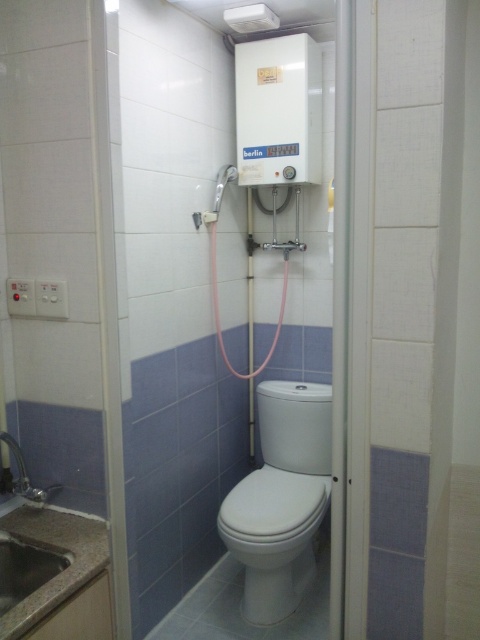
Looking at this image, does white glossy toilet at center appear on the left side of matte white shower at upper center?

In fact, white glossy toilet at center is to the right of matte white shower at upper center.

Is point (312, 556) farther from viewer compared to point (219, 179)?

Yes, point (312, 556) is behind point (219, 179).

Locate an element on the screen. white glossy toilet at center is located at coordinates (280, 499).

Looking at this image, does white glossy toilet at center appear over granite sink at lower left?

No, white glossy toilet at center is not above granite sink at lower left.

Between point (252, 576) and point (60, 556), which one is positioned in front?

Point (60, 556) is in front.

Is point (229, 540) positioned in front of point (2, 577)?

No.

Where is `white glossy toilet at center`? This screenshot has width=480, height=640. white glossy toilet at center is located at coordinates (280, 499).

Image resolution: width=480 pixels, height=640 pixels. What are the coordinates of `granite sink at lower left` in the screenshot? It's located at 26,566.

Is granite sink at lower left shorter than matte white shower at upper center?

Yes.

Find the location of `granite sink at lower left`. granite sink at lower left is located at coordinates (26, 566).